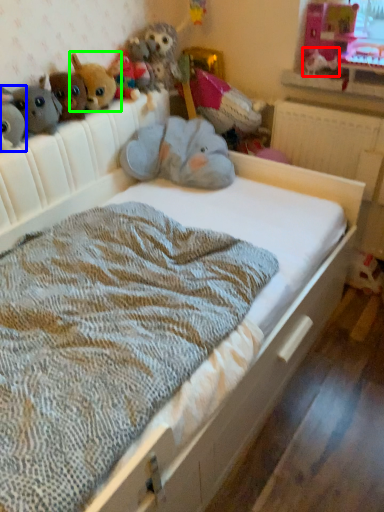
Question: Which object is the closest to the animal (highlighted by a red box)? Choose among these: toy (highlighted by a blue box) or toy (highlighted by a green box).

Choices:
 (A) toy
 (B) toy

Answer: (B)